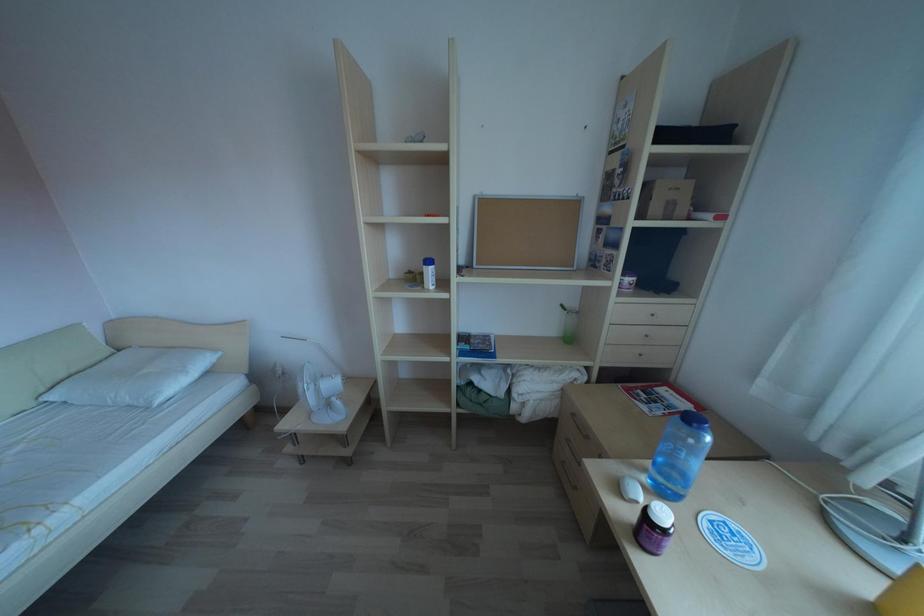
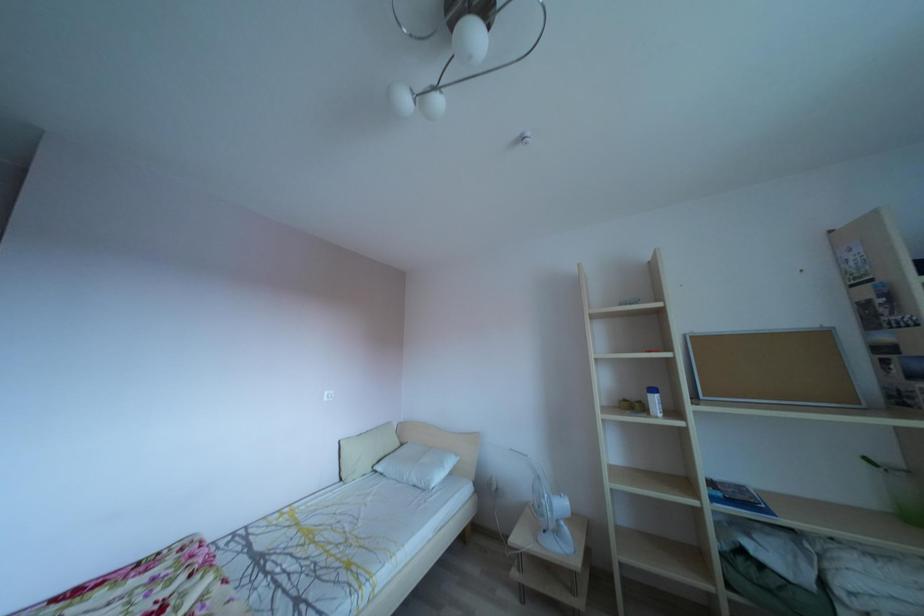
The images are taken continuously from a first-person perspective. In which direction is your viewpoint rotating?

The rotation direction of the camera is left-up.